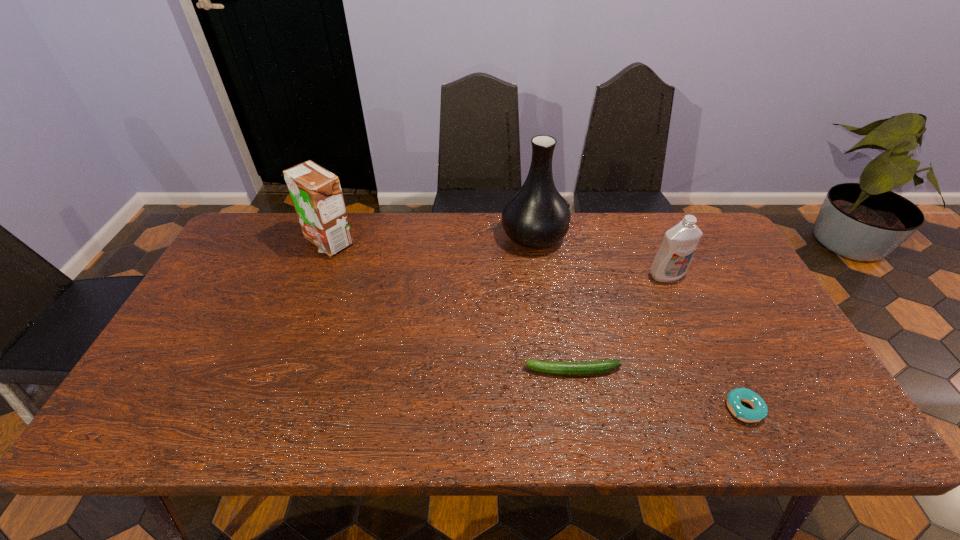
Identify the location of free space in the image that satisfies the following two spatial constraints: 1. on the front-facing side of the nearest object; 2. on the right side of the zucchini. pyautogui.click(x=580, y=408).

You are a GUI agent. You are given a task and a screenshot of the screen. Output one action in this format:
    pyautogui.click(x=<x>, y=<y>)
    Task: Click on the vacant area in the image that satisfies the following two spatial constraints: 1. on the front-facing side of the doughnut; 2. on the left side of the zucchini
    The width and height of the screenshot is (960, 540).
    Given the screenshot: What is the action you would take?
    pyautogui.click(x=580, y=408)